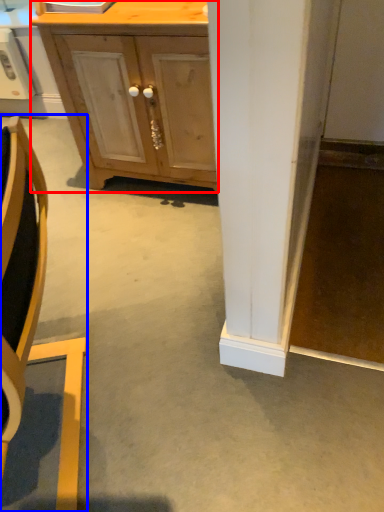
Question: Which of the following is the farthest to the observer, cabinetry (highlighted by a red box) or chair (highlighted by a blue box)?

Choices:
 (A) cabinetry
 (B) chair

Answer: (A)